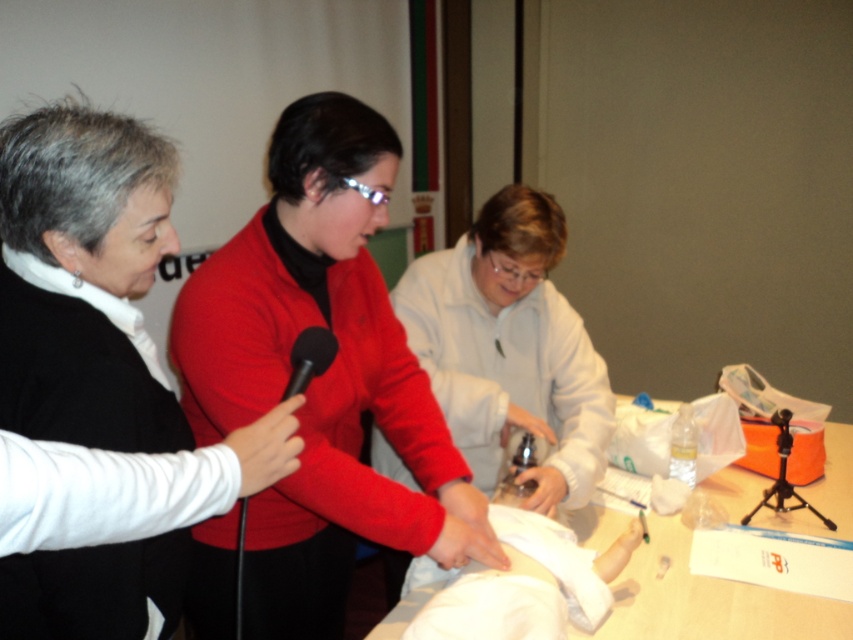
You are attending a presentation and need to determine which object is taller between the matte black jacket at left and the black matte microphone at center. Based on the scene, which one is taller?

The matte black jacket at left is much taller than the black matte microphone at center according to the description.

You are a stagehand setting up for an event. You need to place a 1.2 meter tall speaker stand between the wooden table at center and the black matte microphone at center. Can you fit it there?

The wooden table at center is below the black matte microphone at center, so there is vertical space between them. However, the speaker stand is 1.2 meters tall, which may exceed the vertical clearance between the table and microphone. Check the exact height difference before placing it.